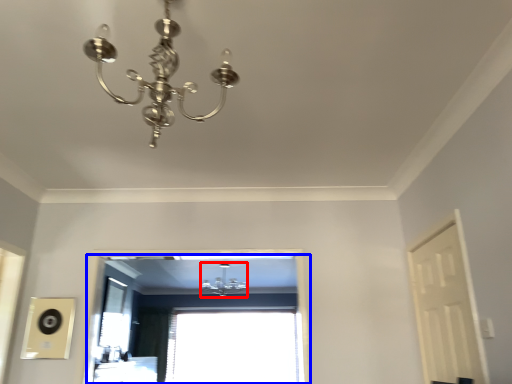
Question: Which object appears closest to the camera in this image, lamp (highlighted by a red box) or window (highlighted by a blue box)?

Choices:
 (A) lamp
 (B) window

Answer: (B)